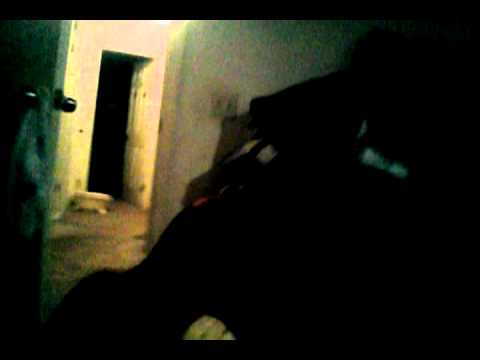
Identify the location of wall. (259, 64).